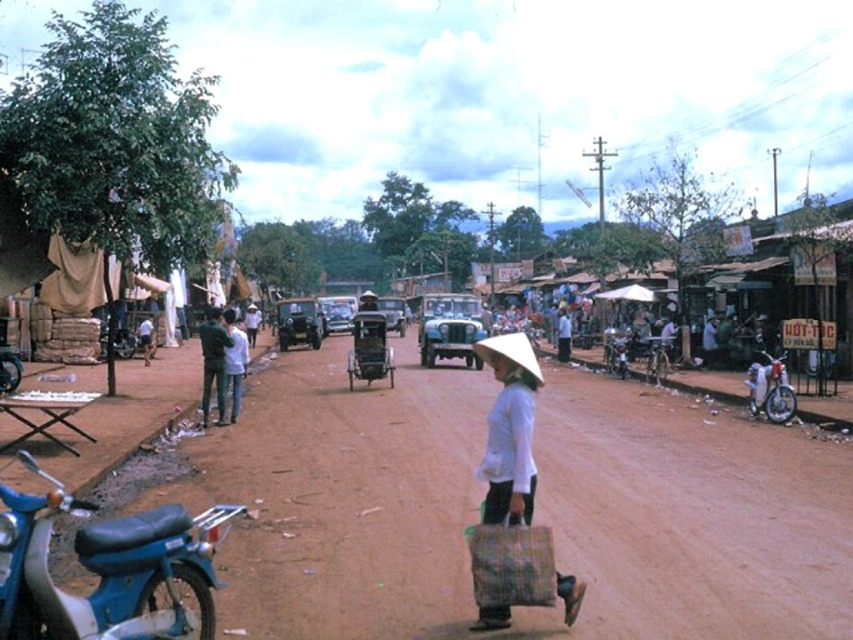
You are a pedestrian standing at the center of the street. You see the white glossy motorcycle at right and the dark green fabric jacket at center. Which object is positioned lower in the image?

The white glossy motorcycle at right is positioned lower than the dark green fabric jacket at center in the image.

You are a traveler carrying a white woven bag at center and a dark green fabric jacket at center. You need to pack them into a backpack with limited space. Which item should you place first to optimize space?

The white woven bag at center is smaller than the dark green fabric jacket at center, so you should place the dark green fabric jacket at center first to optimize space.